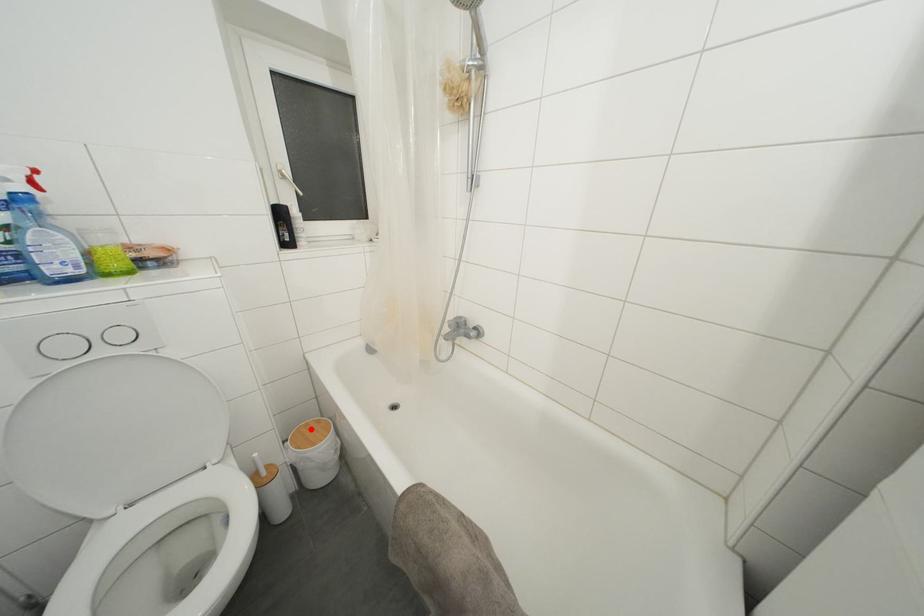
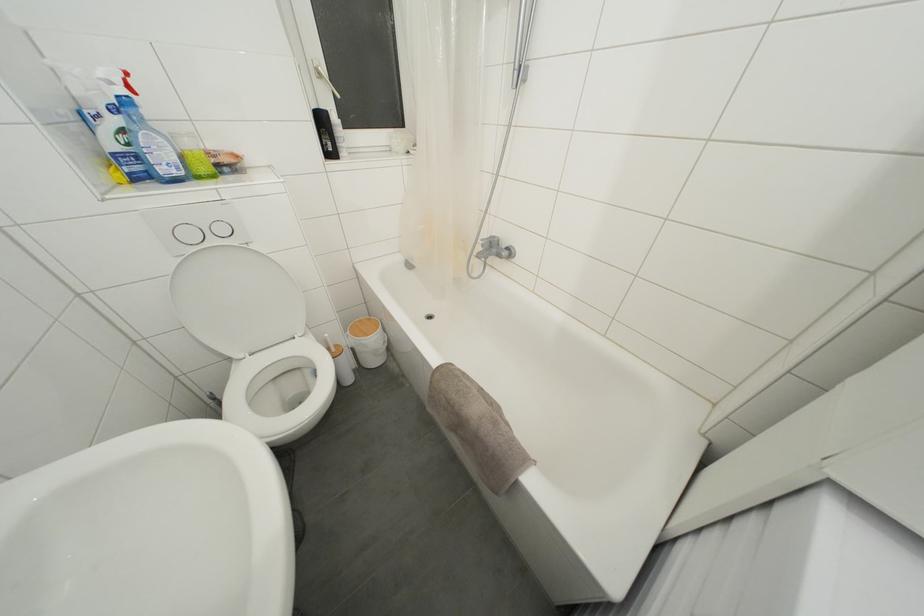
Locate, in the second image, the point that corresponds to the highlighted location in the first image.

(363, 326)